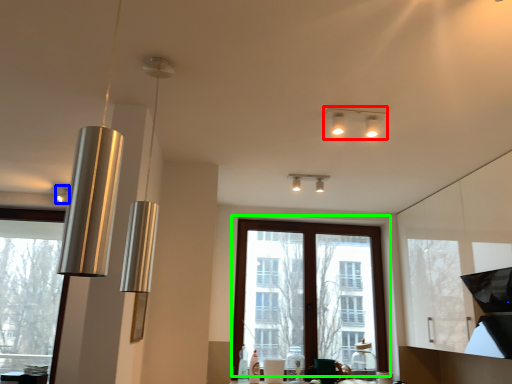
Question: Considering the real-world distances, which object is farthest from lamp (highlighted by a red box)? lamp (highlighted by a blue box) or window (highlighted by a green box)?

Choices:
 (A) lamp
 (B) window

Answer: (A)